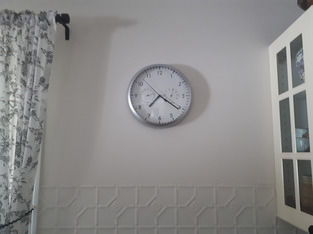
I want to click on second hands on the clock, so click(x=147, y=83).